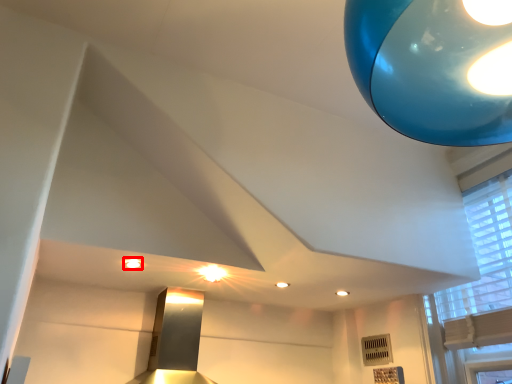
Question: In this image, where is lighting (annotated by the red box) located relative to window?

Choices:
 (A) left
 (B) right

Answer: (A)